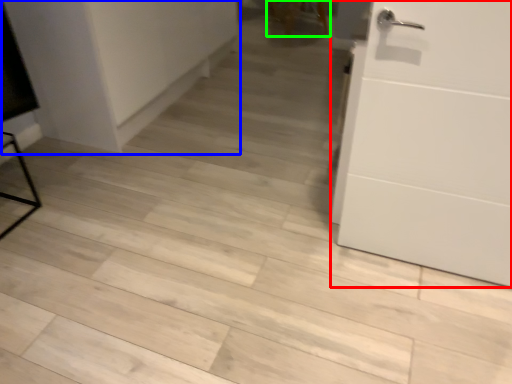
Question: Estimate the real-world distances between objects in this image. Which object is farther from door (highlighted by a red box), cabinetry (highlighted by a blue box) or chair (highlighted by a green box)?

Choices:
 (A) cabinetry
 (B) chair

Answer: (B)